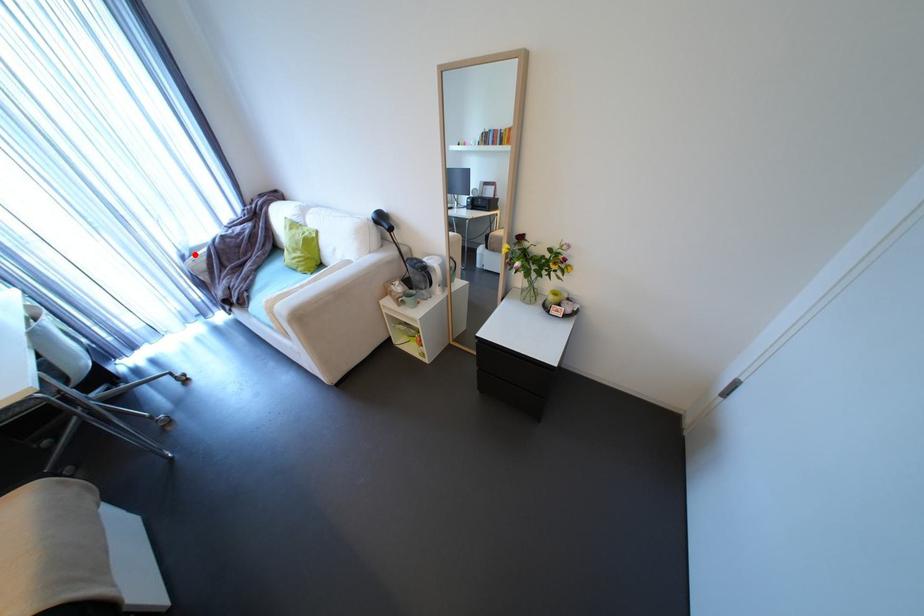
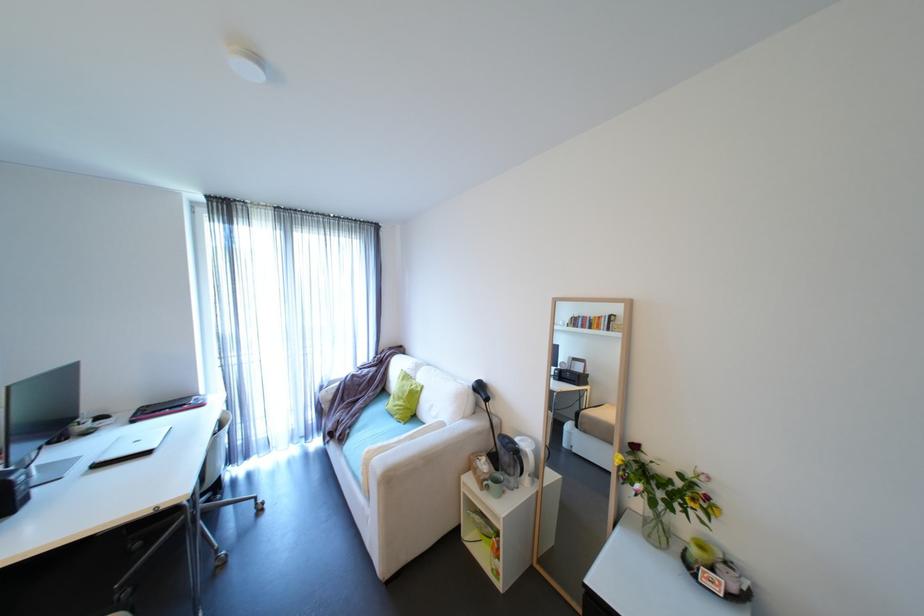
Find the pixel in the second image that matches the highlighted location in the first image.

(333, 386)